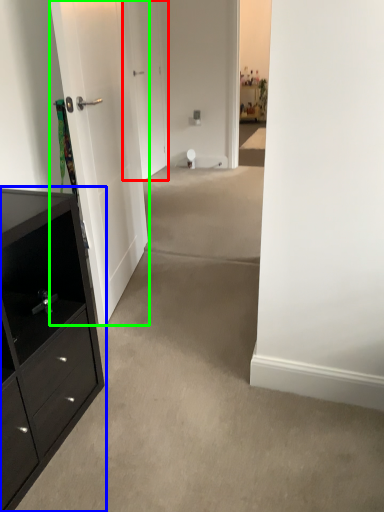
Question: Based on their relative distances, which object is nearer to door (highlighted by a red box)? Choose from chest of drawers (highlighted by a blue box) and door (highlighted by a green box).

Choices:
 (A) chest of drawers
 (B) door

Answer: (B)